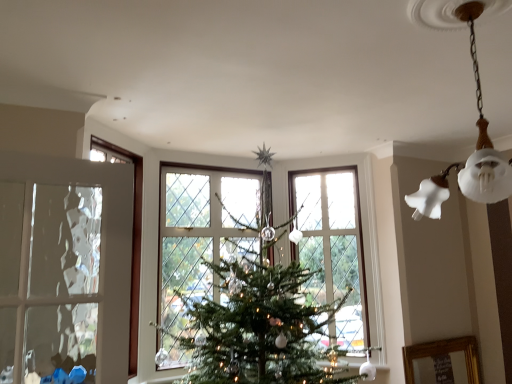
Question: In terms of height, does white frosted glass bell at upper right look taller or shorter compared to clear glass window at center?

Choices:
 (A) tall
 (B) short

Answer: (B)

Question: From the image's perspective, relative to clear glass window at center, is white frosted glass bell at upper right above or below?

Choices:
 (A) below
 (B) above

Answer: (B)

Question: Is point (466, 160) closer or farther from the camera than point (342, 266)?

Choices:
 (A) farther
 (B) closer

Answer: (B)

Question: From the image's perspective, is clear glass window at center positioned above or below white frosted glass bell at upper right?

Choices:
 (A) above
 (B) below

Answer: (B)

Question: Considering the positions of clear glass window at center and white frosted glass bell at upper right in the image, is clear glass window at center wider or thinner than white frosted glass bell at upper right?

Choices:
 (A) thin
 (B) wide

Answer: (A)

Question: From a real-world perspective, is clear glass window at center above or below white frosted glass bell at upper right?

Choices:
 (A) below
 (B) above

Answer: (A)

Question: Would you say clear glass window at center is inside or outside white frosted glass bell at upper right?

Choices:
 (A) outside
 (B) inside

Answer: (A)